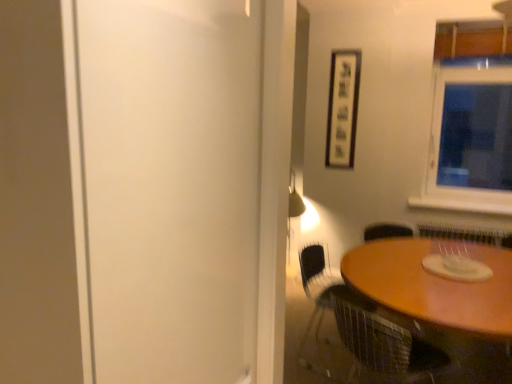
Question: Is point (215, 370) positioned closer to the camera than point (429, 370)?

Choices:
 (A) farther
 (B) closer

Answer: (B)

Question: Based on their positions, is white matte screen door at left located to the left or right of metal mesh chair at lower right?

Choices:
 (A) right
 (B) left

Answer: (B)

Question: Which object is positioned farthest from the white matte screen door at left?

Choices:
 (A) wooden framed artwork at upper right
 (B) wooden table at lower right
 (C) transparent glass window at upper right
 (D) metal mesh chair at lower right

Answer: (C)

Question: Which object is positioned farthest from the wooden table at lower right?

Choices:
 (A) white matte screen door at left
 (B) transparent glass window at upper right
 (C) metal mesh chair at lower right
 (D) wooden framed artwork at upper right

Answer: (A)